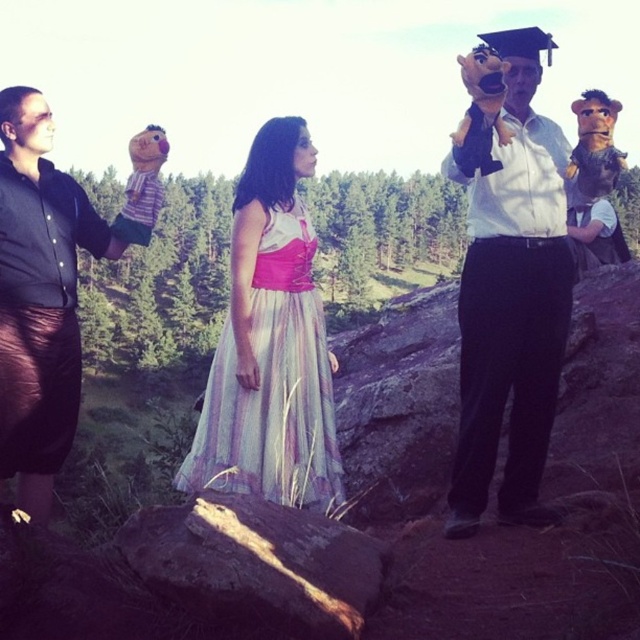
You are trying to decide which item to grab first between the white shirt at center and the matte black glove at left. Based on their sizes, which one is easier to reach?

The white shirt at center has a larger size compared to the matte black glove at left, so it is easier to reach.

You are a photographer setting up a shoot in this outdoor scene. You notice the matte black glove at left and the pastel chiffon dress at center. Which object would block the view of the other when standing at the photographer position? Please explain your reasoning based on their positions.

The matte black glove at left is in front of the pastel chiffon dress at center, so the matte black glove at left would block the view of the pastel chiffon dress at center.